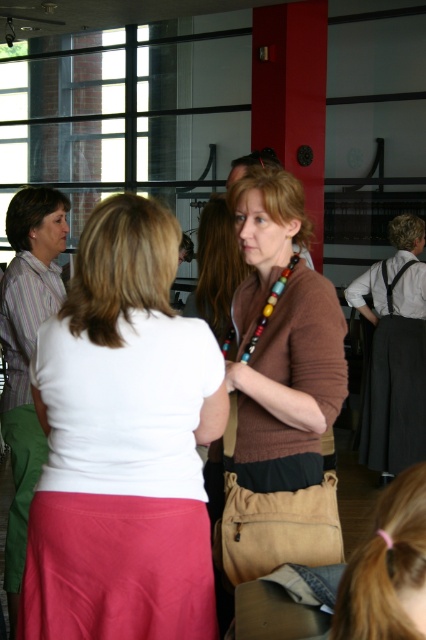
You are a photographer trying to capture a candid shot of both the white matte shirt at center and the brown matte sweater at center. Since you want to ensure both subjects are fully visible in the frame, which subject should you focus on first to account for their height difference?

The white matte shirt at center is shorter than the brown matte sweater at center. To ensure both are fully visible, focus on the taller brown matte sweater at center first, then adjust the frame to include the shorter white matte shirt at center.

You are a photographer trying to capture a candid shot of both the white matte shirt at center and the brown matte sweater at center. Given that your camera has a maximum focus range of 12 inches, will you be able to focus on both subjects simultaneously?

The distance between the white matte shirt at center and the brown matte sweater at center is 12.52 inches. Since this exceeds the camera maximum focus range of 12 inches, you cannot focus on both subjects simultaneously.